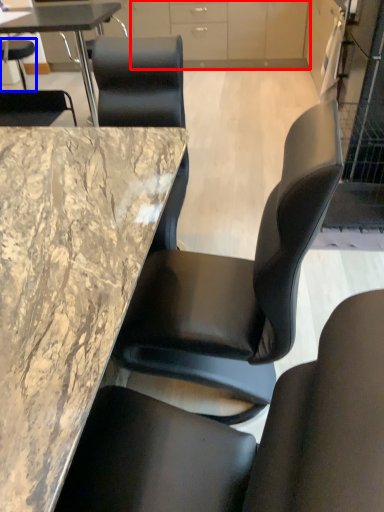
Question: Which point is closer to the camera, cabinetry (highlighted by a red box) or chair (highlighted by a blue box)?

Choices:
 (A) cabinetry
 (B) chair

Answer: (A)